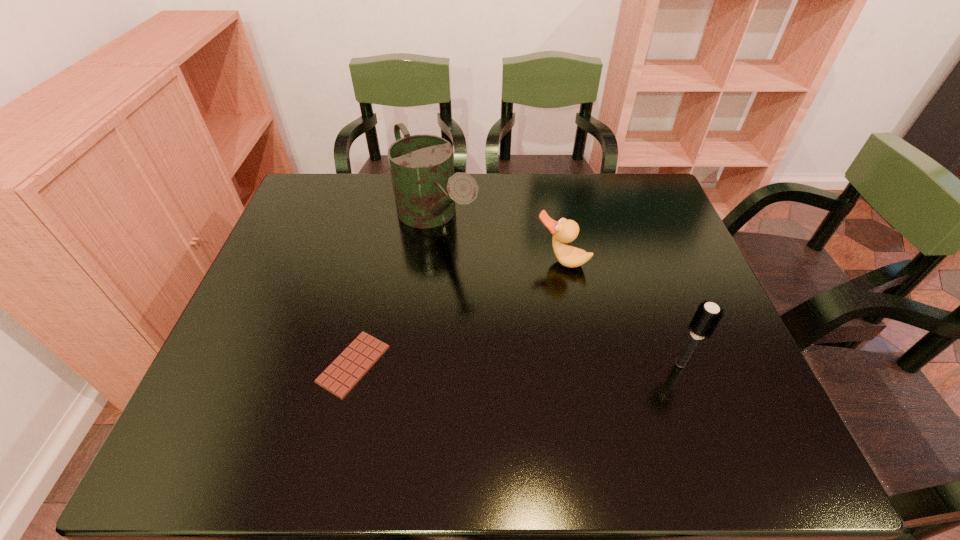
The width and height of the screenshot is (960, 540). Find the location of `free space located with the spout on the tallest object`. free space located with the spout on the tallest object is located at coordinates (522, 343).

The image size is (960, 540). What are the coordinates of `vacant space located on the beak of the third tallest object` in the screenshot? It's located at (487, 382).

Where is `vacant area situated 0.120m on the beak of the third tallest object`? The width and height of the screenshot is (960, 540). vacant area situated 0.120m on the beak of the third tallest object is located at coordinates click(533, 302).

This screenshot has width=960, height=540. Find the location of `free region located 0.080m on the beak of the third tallest object`. free region located 0.080m on the beak of the third tallest object is located at coordinates (540, 292).

You are a GUI agent. You are given a task and a screenshot of the screen. Output one action in this format:
    pyautogui.click(x=<x>, y=<y>)
    Task: Click on the object positioned at the far edge
    
    Given the screenshot: What is the action you would take?
    pyautogui.click(x=425, y=187)

You are a GUI agent. You are given a task and a screenshot of the screen. Output one action in this format:
    pyautogui.click(x=<x>, y=<y>)
    Task: Click on the object that is at the near edge
    Image resolution: width=960 pixels, height=540 pixels.
    Given the screenshot: What is the action you would take?
    pyautogui.click(x=353, y=363)

Where is `object located in the right edge section of the desktop`? The image size is (960, 540). object located in the right edge section of the desktop is located at coordinates (708, 315).

Image resolution: width=960 pixels, height=540 pixels. I want to click on free space at the far edge of the desktop, so click(x=480, y=217).

You are a GUI agent. You are given a task and a screenshot of the screen. Output one action in this format:
    pyautogui.click(x=<x>, y=<y>)
    Task: Click on the vacant space at the near edge
    The height and width of the screenshot is (540, 960).
    Given the screenshot: What is the action you would take?
    pyautogui.click(x=411, y=410)

I want to click on vacant space at the left edge of the desktop, so click(x=270, y=285).